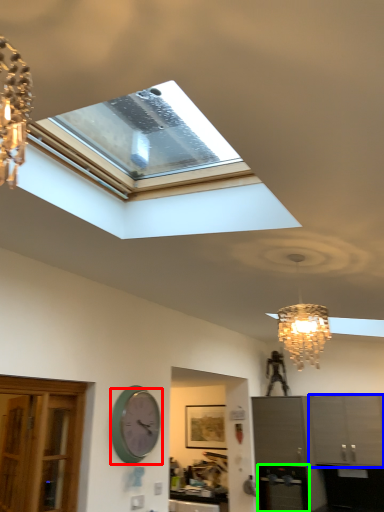
Question: Based on their relative distances, which object is nearer to wall clock (highlighted by a red box)? Choose from cabinetry (highlighted by a blue box) and appliance (highlighted by a green box).

Choices:
 (A) cabinetry
 (B) appliance

Answer: (B)